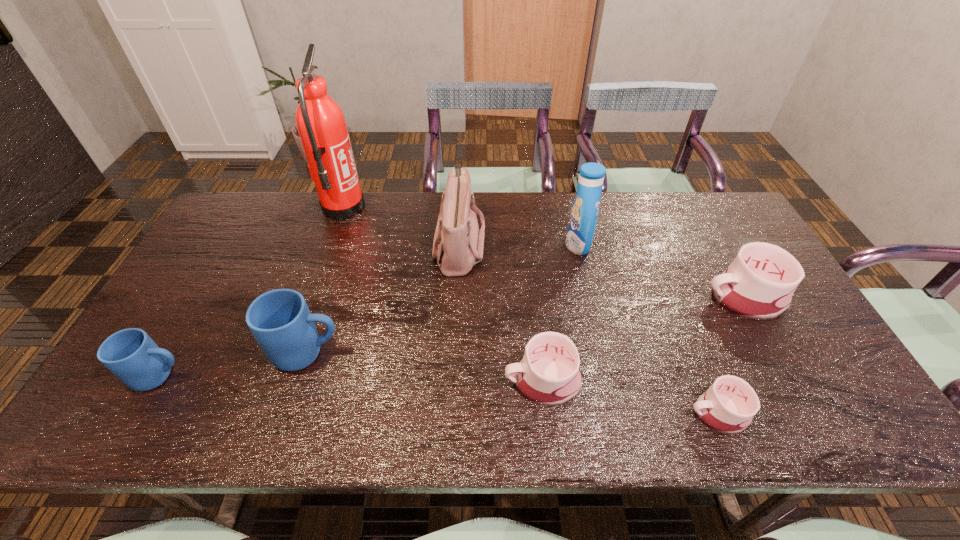
I want to click on fire extinguisher present at the far edge, so click(x=321, y=124).

Locate an element on the screen. The height and width of the screenshot is (540, 960). detergent that is at the far edge is located at coordinates (583, 218).

Where is `shoulder bag at the far edge`? shoulder bag at the far edge is located at coordinates (458, 244).

You are a GUI agent. You are given a task and a screenshot of the screen. Output one action in this format:
    pyautogui.click(x=<x>, y=<y>)
    Task: Click on the object that is positioned at the left edge
    This screenshot has width=960, height=540.
    Given the screenshot: What is the action you would take?
    pyautogui.click(x=130, y=354)

You are a GUI agent. You are given a task and a screenshot of the screen. Output one action in this format:
    pyautogui.click(x=<x>, y=<y>)
    Task: Click on the object at the right edge
    The image size is (960, 540).
    Given the screenshot: What is the action you would take?
    pyautogui.click(x=759, y=284)

Find the location of a particular element. The width and height of the screenshot is (960, 540). free spot at the far edge of the desktop is located at coordinates (504, 222).

The width and height of the screenshot is (960, 540). Identify the location of vacant space at the near edge of the desktop. (521, 406).

Identify the location of free location at the left edge. (198, 265).

The height and width of the screenshot is (540, 960). Identify the location of vacant space at the right edge of the desktop. (834, 372).

Where is `free spot between the rightmost white mug and the fire extinguisher`? free spot between the rightmost white mug and the fire extinguisher is located at coordinates (542, 253).